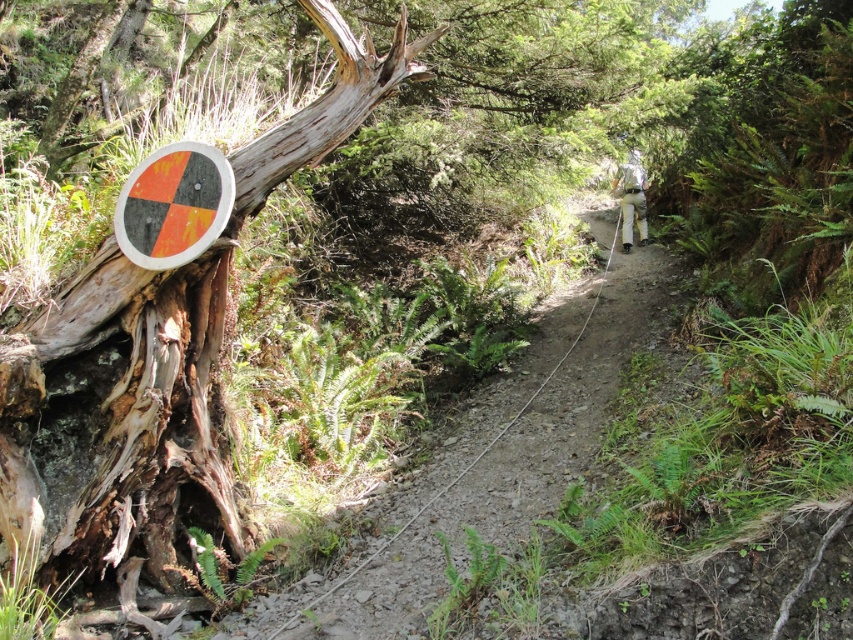
Question: Which of these objects is positioned closest to the weathered wood tree trunk at left?

Choices:
 (A) dirt path at center
 (B) orange matte sign at left

Answer: (B)

Question: Does weathered wood tree trunk at left have a larger size compared to orange matte sign at left?

Choices:
 (A) no
 (B) yes

Answer: (B)

Question: Is weathered wood tree trunk at left to the right of orange matte sign at left from the viewer's perspective?

Choices:
 (A) yes
 (B) no

Answer: (A)

Question: Which point is closer to the camera taking this photo?

Choices:
 (A) (146, 266)
 (B) (413, 588)
 (C) (33, 518)

Answer: (C)

Question: Is weathered wood tree trunk at left in front of dirt path at center?

Choices:
 (A) no
 (B) yes

Answer: (B)

Question: Which point is farther to the camera?

Choices:
 (A) (514, 387)
 (B) (157, 324)

Answer: (A)